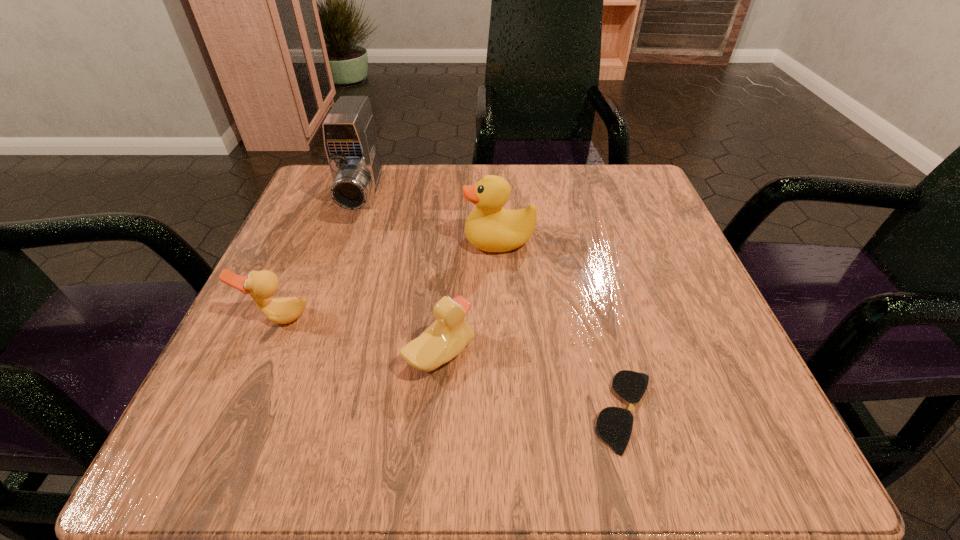
You are a GUI agent. You are given a task and a screenshot of the screen. Output one action in this format:
    pyautogui.click(x=<x>, y=<y>)
    Task: Click on the free space that satisfies the following two spatial constraints: 1. on the beak of the shortest object; 2. on the left side of the leftmost duck
    The width and height of the screenshot is (960, 540).
    Given the screenshot: What is the action you would take?
    238,411

The width and height of the screenshot is (960, 540). Find the location of `free spot that satisfies the following two spatial constraints: 1. at the beak of the fourth shortest object; 2. on the beak of the leftmost duck`. free spot that satisfies the following two spatial constraints: 1. at the beak of the fourth shortest object; 2. on the beak of the leftmost duck is located at coordinates (503, 318).